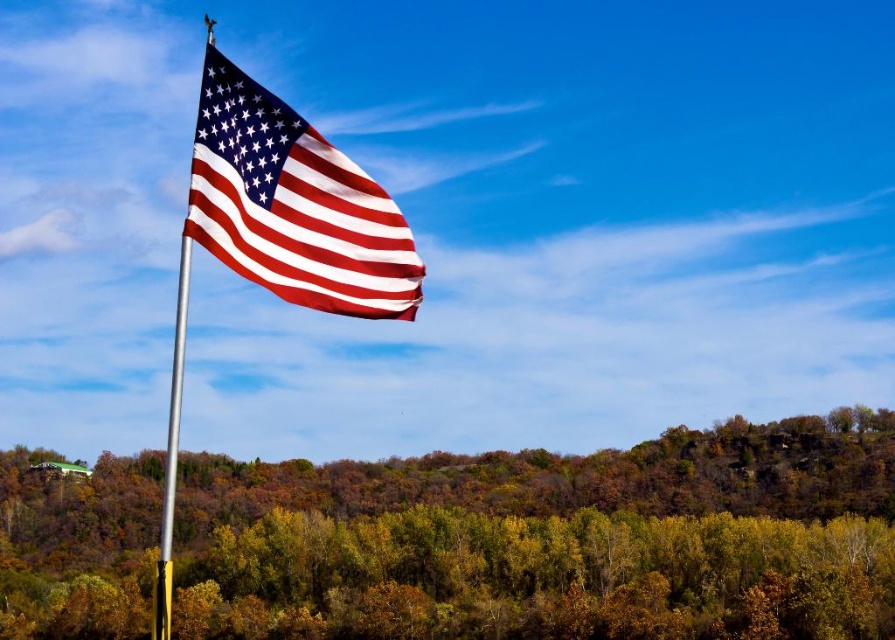
Question: Does green leafy tree at center appear on the right side of matte fabric flag at upper left?

Choices:
 (A) yes
 (B) no

Answer: (B)

Question: Is matte fabric flag at upper left in front of silver metallic pole at left?

Choices:
 (A) no
 (B) yes

Answer: (A)

Question: Is green leafy tree at center above matte fabric flag at upper left?

Choices:
 (A) yes
 (B) no

Answer: (B)

Question: Which of the following is the farthest from the observer?

Choices:
 (A) (176, 387)
 (B) (149, 480)

Answer: (B)

Question: Which of the following is the farthest from the observer?

Choices:
 (A) (730, 449)
 (B) (160, 579)
 (C) (322, 234)

Answer: (A)

Question: Which object is positioned closest to the green leafy tree at center?

Choices:
 (A) matte fabric flag at upper left
 (B) silver metallic pole at left

Answer: (B)